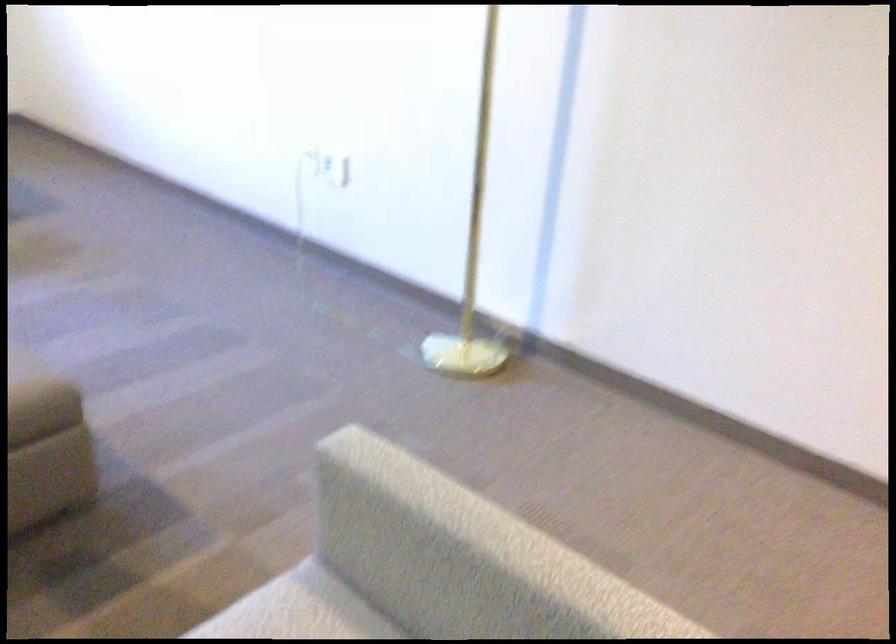
Where would you lean the brown sofa armrest? Please return your answer as a coordinate pair (x, y).

(41, 397)